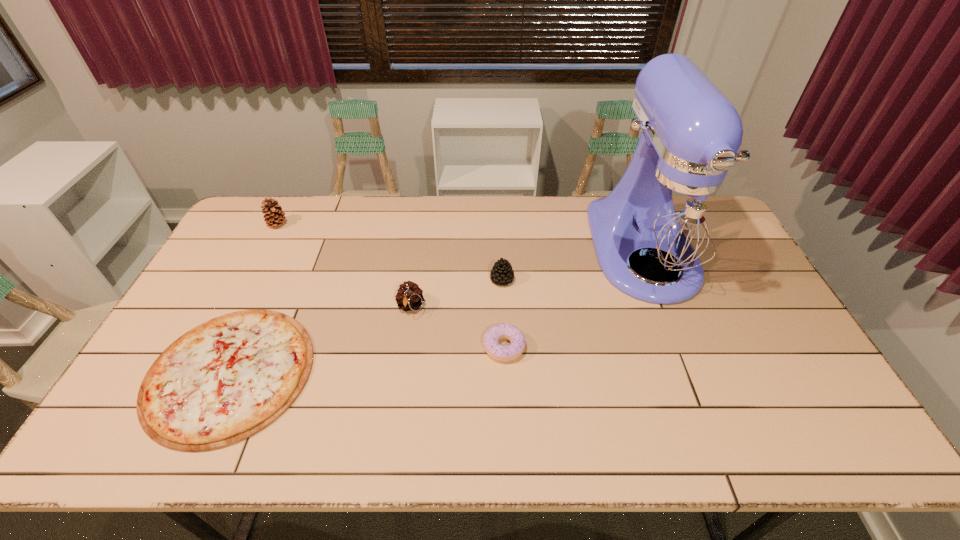
Identify the location of pinecone located in the left edge section of the desktop. (274, 215).

At what (x,y) coordinates should I click in order to perform the action: click on pizza present at the left edge. Please return your answer as a coordinate pair (x, y). This screenshot has width=960, height=540. Looking at the image, I should click on (223, 381).

Identify the location of object present at the right edge. (674, 213).

This screenshot has height=540, width=960. Identify the location of object present at the far left corner. (274, 215).

Locate an element on the screen. object positioned at the near left corner is located at coordinates (x=223, y=381).

I want to click on object that is at the far right corner, so click(x=674, y=213).

Where is `free space at the far edge`? The image size is (960, 540). free space at the far edge is located at coordinates (408, 212).

In order to click on free spot at the near edge of the desktop in this screenshot , I will do `click(494, 417)`.

Where is `free point at the left edge`? This screenshot has width=960, height=540. free point at the left edge is located at coordinates (273, 242).

You are a GUI agent. You are given a task and a screenshot of the screen. Output one action in this format:
    pyautogui.click(x=<x>, y=<y>)
    Task: Click on the free space at the far left corner of the desktop
    The height and width of the screenshot is (540, 960).
    Given the screenshot: What is the action you would take?
    pyautogui.click(x=280, y=200)